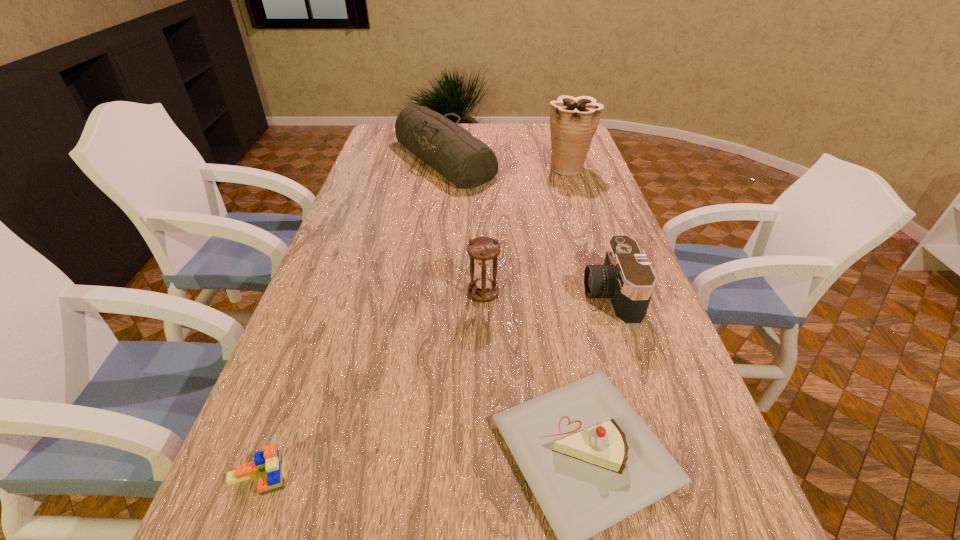
I want to click on free space at the right edge of the desktop, so click(x=671, y=448).

Image resolution: width=960 pixels, height=540 pixels. In order to click on vacant space in between the urn and the Lego in this screenshot , I will do click(413, 322).

Where is `free space between the Lego and the hourglass`? free space between the Lego and the hourglass is located at coordinates (371, 385).

Locate an element on the screen. The width and height of the screenshot is (960, 540). free space between the hourglass and the duffel bag is located at coordinates (464, 226).

This screenshot has width=960, height=540. I want to click on free point between the duffel bag and the urn, so click(506, 164).

Identify the location of free space between the camera and the duffel bag. (527, 227).

Choose which object is the fifth nearest neighbor to the tallest object. Please provide its 2D coordinates. Your answer should be formatted as a tuple, i.e. [(x, y)], where the tuple contains the x and y coordinates of a point satisfying the conditions above.

[(270, 461)]

Identify which object is the fifth nearest to the fifth tallest object. Please provide its 2D coordinates. Your answer should be formatted as a tuple, i.e. [(x, y)], where the tuple contains the x and y coordinates of a point satisfying the conditions above.

[(573, 121)]

Locate an element on the screen. The height and width of the screenshot is (540, 960). vacant space that satisfies the following two spatial constraints: 1. on the back side of the shortest object; 2. on the right side of the duffel bag is located at coordinates (378, 159).